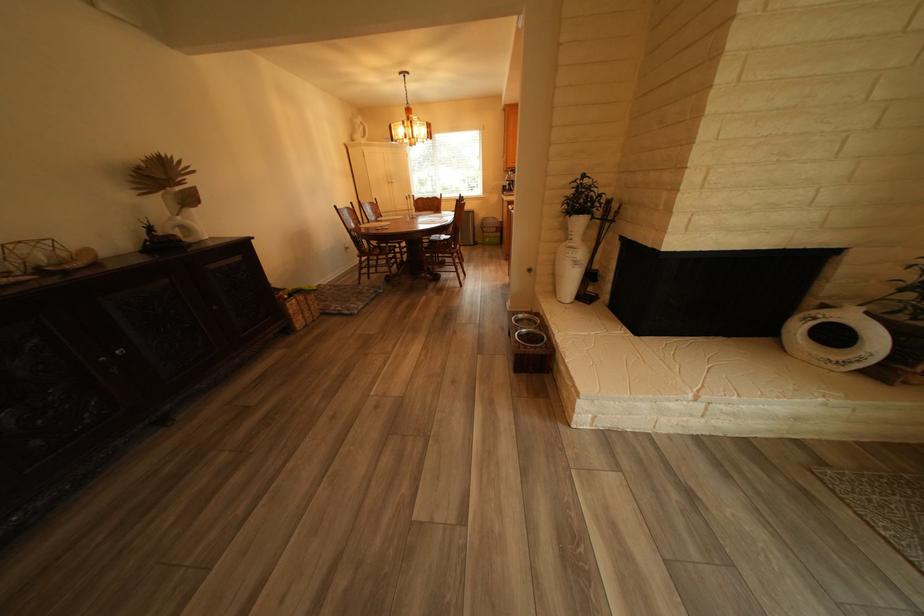
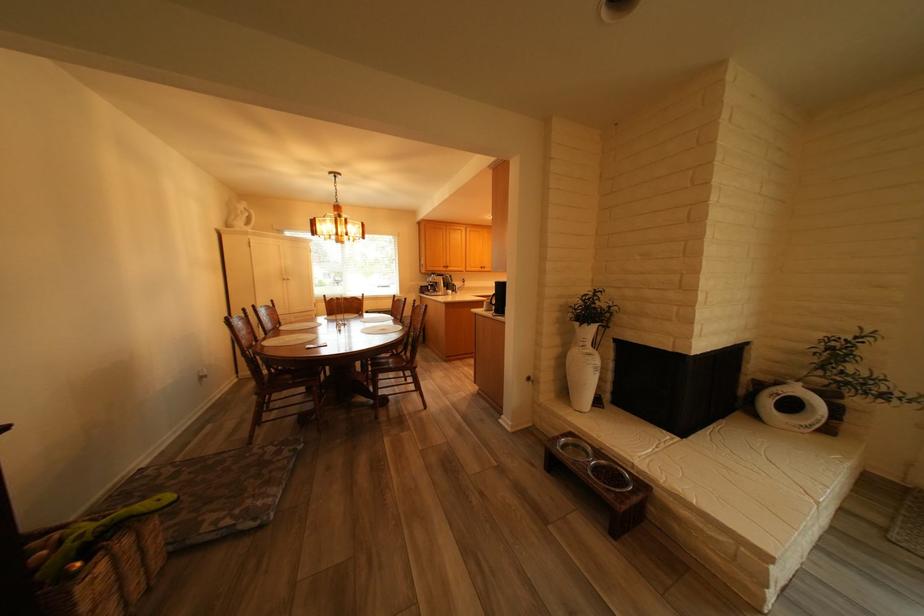
Question: I am providing you with two images of the same scene from different viewpoints. Please identify which objects are invisible in image2.

Choices:
 (A) white head sculpture
 (B) white placemat
 (C) white ring sculpture
 (D) none of these

Answer: (D)